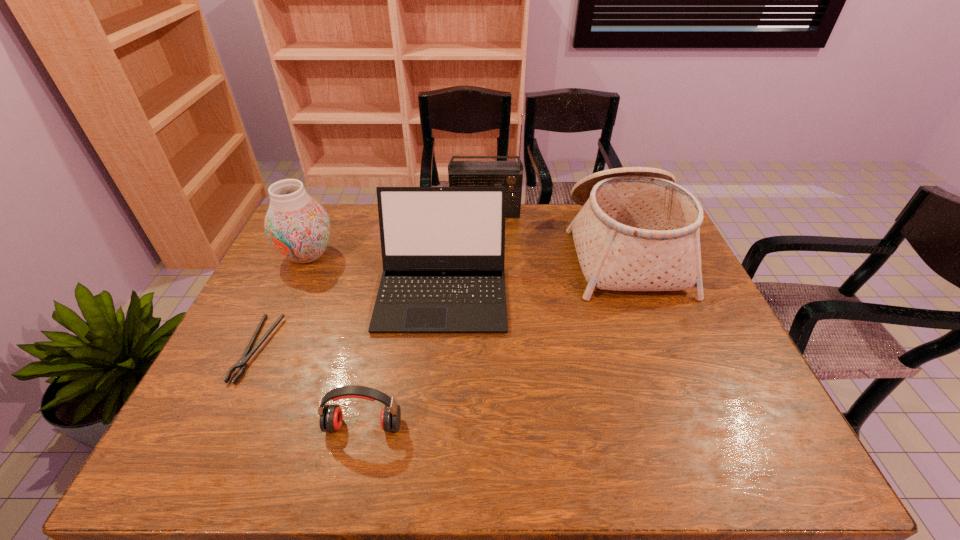
Where is `vacant area that lies between the laptop and the rightmost object`? The width and height of the screenshot is (960, 540). vacant area that lies between the laptop and the rightmost object is located at coordinates (533, 271).

You are a GUI agent. You are given a task and a screenshot of the screen. Output one action in this format:
    pyautogui.click(x=<x>, y=<y>)
    Task: Click on the vacant space in between the vase and the laptop
    Image resolution: width=960 pixels, height=540 pixels.
    Given the screenshot: What is the action you would take?
    pyautogui.click(x=375, y=273)

I want to click on object that can be found as the fourth closest to the tallest object, so click(242, 363).

I want to click on the fifth closest object to the second shortest object, so click(509, 174).

The height and width of the screenshot is (540, 960). I want to click on free space in the image that satisfies the following two spatial constraints: 1. with the lid open on the basket; 2. on the ear cups of the fifth tallest object, so click(691, 426).

At what (x,y) coordinates should I click in order to perform the action: click on blank area in the image that satisfies the following two spatial constraints: 1. with the lid open on the rightmost object; 2. on the surface of the laptop. Please return your answer as a coordinate pair (x, y). Looking at the image, I should click on (639, 292).